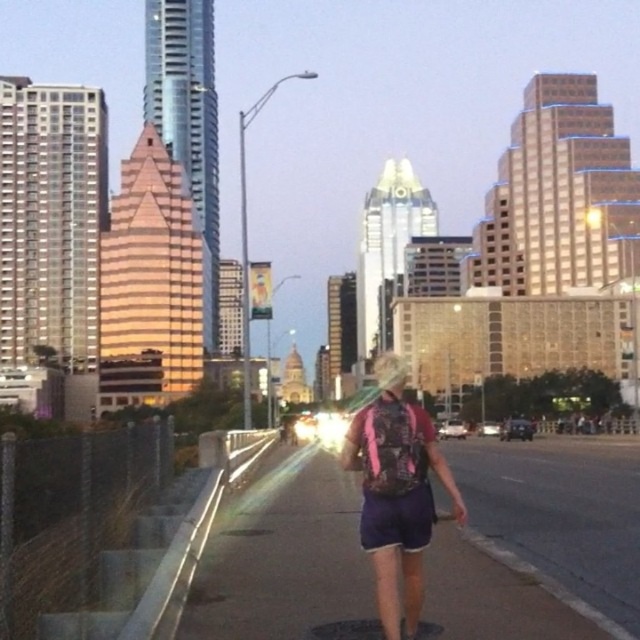
You are a pedestrian standing on the purple fabric pavement at center and want to walk towards the pink fabric shorts at center. Is the path clear?

The purple fabric pavement at center is positioned under pink fabric shorts at center, so the path is clear.

You are a delivery drone operator who needs to fly a drone through the space between the purple fabric pavement at center and the pink fabric shorts at center. The drone is 1.2 meters tall. Can the drone safely pass through this space without hitting either object?

The purple fabric pavement at center is much taller than the pink fabric shorts at center. Since the drone is 1.2 meters tall, it can safely pass through the space between them as long as it stays below the purple fabric pavement at center and above the pink fabric shorts at center.